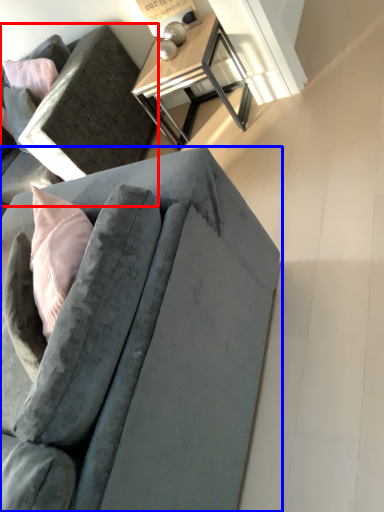
Question: Among these objects, which one is nearest to the camera, studio couch (highlighted by a red box) or studio couch (highlighted by a blue box)?

Choices:
 (A) studio couch
 (B) studio couch

Answer: (B)